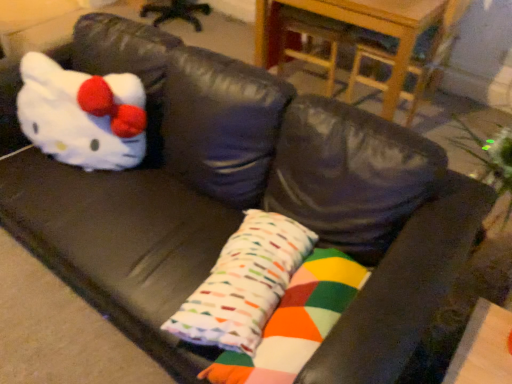
Question: From the image's perspective, does wooden table at upper center appear lower than white plush toy at left?

Choices:
 (A) no
 (B) yes

Answer: (A)

Question: Is wooden table at upper center closer to the viewer compared to white plush toy at left?

Choices:
 (A) no
 (B) yes

Answer: (A)

Question: Would you say wooden table at upper center is a long distance from white plush toy at left?

Choices:
 (A) yes
 (B) no

Answer: (A)

Question: Is wooden table at upper center positioned behind white plush toy at left?

Choices:
 (A) no
 (B) yes

Answer: (B)

Question: Is wooden table at upper center directly adjacent to white plush toy at left?

Choices:
 (A) no
 (B) yes

Answer: (A)

Question: From the image's perspective, would you say wooden table at upper center is positioned over white plush toy at left?

Choices:
 (A) yes
 (B) no

Answer: (A)

Question: Is wooden table at upper center shorter than multicolored fabric pillow at center?

Choices:
 (A) no
 (B) yes

Answer: (A)

Question: Considering the relative positions of wooden table at upper center and multicolored fabric pillow at center in the image provided, is wooden table at upper center to the right of multicolored fabric pillow at center from the viewer's perspective?

Choices:
 (A) no
 (B) yes

Answer: (B)

Question: Considering the relative sizes of wooden table at upper center and multicolored fabric pillow at center in the image provided, is wooden table at upper center taller than multicolored fabric pillow at center?

Choices:
 (A) yes
 (B) no

Answer: (A)

Question: Does wooden table at upper center lie in front of multicolored fabric pillow at center?

Choices:
 (A) no
 (B) yes

Answer: (A)

Question: Is wooden table at upper center located outside multicolored fabric pillow at center?

Choices:
 (A) no
 (B) yes

Answer: (B)

Question: From the image's perspective, does wooden table at upper center appear higher than multicolored fabric pillow at center?

Choices:
 (A) yes
 (B) no

Answer: (A)

Question: Considering the relative sizes of white plush toy at left and multicolored fabric pillow at center in the image provided, is white plush toy at left taller than multicolored fabric pillow at center?

Choices:
 (A) no
 (B) yes

Answer: (B)